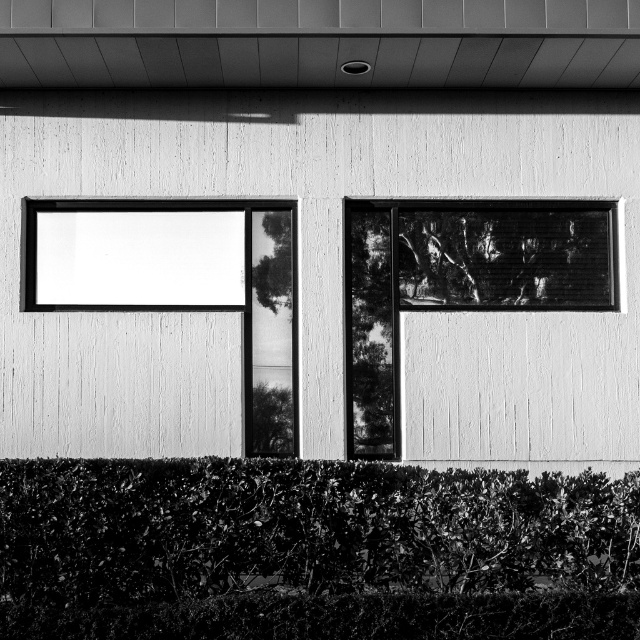
Consider the image. Can you confirm if transparent glass window at upper left is positioned above smooth glass window at center right?

Indeed, transparent glass window at upper left is positioned over smooth glass window at center right.

Is point (264, 448) more distant than point (426, 264)?

That is False.

Which is in front, point (198, 292) or point (611, 282)?

Point (198, 292) is more forward.

Locate an element on the screen. This screenshot has width=640, height=640. transparent glass window at upper left is located at coordinates (182, 282).

Is green leafy hedge at lower center further to the viewer compared to transparent glass window at upper left?

No.

Who is shorter, green leafy hedge at lower center or transparent glass window at upper left?

Standing shorter between the two is green leafy hedge at lower center.

The width and height of the screenshot is (640, 640). I want to click on green leafy hedge at lower center, so click(x=314, y=552).

Is green leafy hedge at lower center taller than smooth glass window at center right?

In fact, green leafy hedge at lower center may be shorter than smooth glass window at center right.

Which is in front, point (196, 618) or point (481, 211)?

Point (196, 618) is more forward.

Is point (326, 586) positioned after point (388, 387)?

That is False.

The image size is (640, 640). Find the location of `green leafy hedge at lower center`. green leafy hedge at lower center is located at coordinates (314, 552).